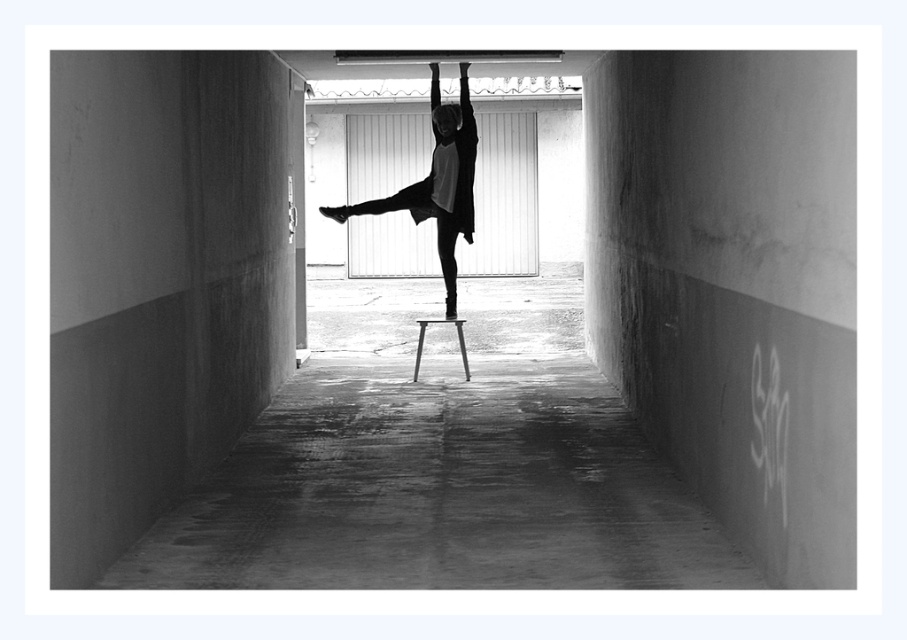
You are a photographer trying to capture the dancer in the matte black dress at center and the metallic silver stool at center. Since the dress and stool are both at the center, which one is closer to the camera?

The matte black dress at center is in front of the metallic silver stool at center, so the dress is closer to the camera.